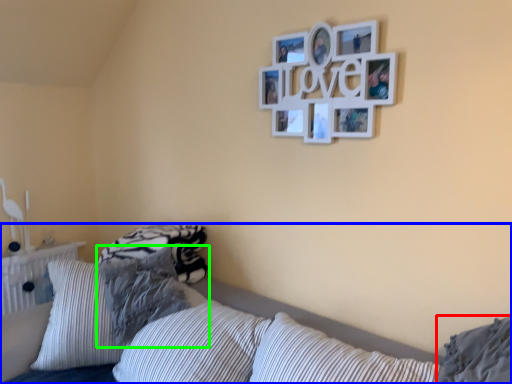
Question: Based on their relative distances, which object is nearer to pillow (highlighted by a red box)? Choose from bed (highlighted by a blue box) and pillow (highlighted by a green box).

Choices:
 (A) bed
 (B) pillow

Answer: (A)